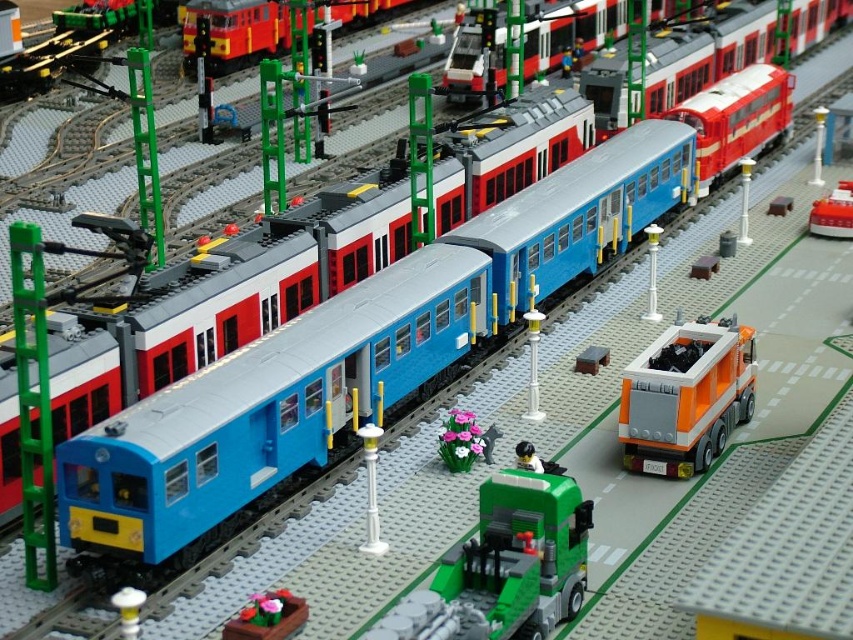
Can you confirm if smooth pink flower pot at lower center is positioned to the right of smooth red truck at center right?

Incorrect, smooth pink flower pot at lower center is not on the right side of smooth red truck at center right.

Which of these two, smooth pink flower pot at lower center or smooth red truck at center right, stands shorter?

smooth pink flower pot at lower center

Is point (294, 627) farther from camera compared to point (807, 227)?

No, it is in front of (807, 227).

This screenshot has width=853, height=640. Find the location of `smooth pink flower pot at lower center`. smooth pink flower pot at lower center is located at coordinates (268, 616).

Can you confirm if orange matte truck at center-right is positioned below smooth red truck at center right?

Indeed, orange matte truck at center-right is positioned under smooth red truck at center right.

At what (x,y) coordinates should I click in order to perform the action: click on orange matte truck at center-right. Please return your answer as a coordinate pair (x, y). Looking at the image, I should click on (686, 396).

Does green matte truck at center have a larger size compared to smooth red truck at center right?

Indeed, green matte truck at center has a larger size compared to smooth red truck at center right.

Can you confirm if green matte truck at center is positioned above smooth red truck at center right?

No, green matte truck at center is not above smooth red truck at center right.

Is point (532, 492) positioned after point (827, 204)?

No, (532, 492) is in front of (827, 204).

In order to click on green matte truck at center in this screenshot , I will do `click(503, 566)`.